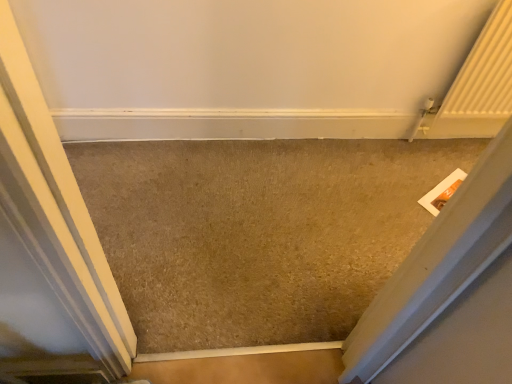
Measure the distance between white matte door at left and camera.

A distance of 15.28 inches exists between white matte door at left and camera.

The height and width of the screenshot is (384, 512). Describe the element at coordinates (49, 244) in the screenshot. I see `white matte door at left` at that location.

Identify the location of white matte door at left. Image resolution: width=512 pixels, height=384 pixels. (49, 244).

What are the coordinates of `beige carpet at center` in the screenshot? It's located at (257, 231).

This screenshot has height=384, width=512. Describe the element at coordinates (257, 231) in the screenshot. I see `beige carpet at center` at that location.

What is the approximate height of beige carpet at center?

1.11 inches.

Identify the location of white matte door at left. click(x=49, y=244).

Which is more to the left, beige carpet at center or white matte door at left?

white matte door at left.

Which object is further away from the camera taking this photo, beige carpet at center or white matte door at left?

Positioned behind is beige carpet at center.

Considering the points (234, 163) and (9, 211), which point is in front, point (234, 163) or point (9, 211)?

Point (9, 211)

From the image's perspective, is beige carpet at center above or below white matte door at left?

Clearly, from the image's perspective, beige carpet at center is above white matte door at left.

From a real-world perspective, which object rests below the other?

From a 3D spatial view, beige carpet at center is below.

Which object is wider, beige carpet at center or white matte door at left?

beige carpet at center is wider.

Does beige carpet at center have a lesser height compared to white matte door at left?

Correct, beige carpet at center is not as tall as white matte door at left.

Looking at the image, does beige carpet at center seem bigger or smaller compared to white matte door at left?

Clearly, beige carpet at center is smaller in size than white matte door at left.

Is beige carpet at center surrounding white matte door at left?

No.

Would you say beige carpet at center is a long distance from white matte door at left?

No, there isn't a large distance between beige carpet at center and white matte door at left.

Does beige carpet at center turn towards white matte door at left?

No, beige carpet at center does not turn towards white matte door at left.

How different are the orientations of beige carpet at center and white matte door at left in degrees?

beige carpet at center and white matte door at left are facing 87.3 degrees away from each other.

Where is `concrete behind the white matte door at left`? concrete behind the white matte door at left is located at coordinates (257, 231).

Based on their positions, is white matte door at left located to the left or right of beige carpet at center?

In the image, white matte door at left appears on the left side of beige carpet at center.

Is white matte door at left further to the viewer compared to beige carpet at center?

No, it is not.

Does point (56, 346) appear closer or farther from the camera than point (261, 241)?

Point (56, 346) is closer to the camera than point (261, 241).

From the image's perspective, who appears lower, white matte door at left or beige carpet at center?

white matte door at left is shown below in the image.

From a real-world perspective, is white matte door at left on beige carpet at center?

Indeed, from a real-world perspective, white matte door at left stands above beige carpet at center.

Considering the sizes of objects white matte door at left and beige carpet at center in the image provided, who is thinner, white matte door at left or beige carpet at center?

white matte door at left is thinner.

Considering the sizes of objects white matte door at left and beige carpet at center in the image provided, who is shorter, white matte door at left or beige carpet at center?

Standing shorter between the two is beige carpet at center.

Does white matte door at left have a larger size compared to beige carpet at center?

Yes, white matte door at left is bigger than beige carpet at center.

Which is correct: white matte door at left is inside beige carpet at center, or outside of it?

white matte door at left is located beyond the bounds of beige carpet at center.

Are white matte door at left and beige carpet at center far apart?

That's not correct — white matte door at left is a little close to beige carpet at center.

Is white matte door at left oriented away from beige carpet at center?

That's not correct — white matte door at left is not looking away from beige carpet at center.

At what (x,y) coordinates should I click in order to perform the action: click on concrete on the right of white matte door at left. Please return your answer as a coordinate pair (x, y). Looking at the image, I should click on [x=257, y=231].

This screenshot has height=384, width=512. What are the coordinates of `door on the left of beige carpet at center` in the screenshot? It's located at (49, 244).

Identify the location of door in front of the beige carpet at center. This screenshot has height=384, width=512. (49, 244).